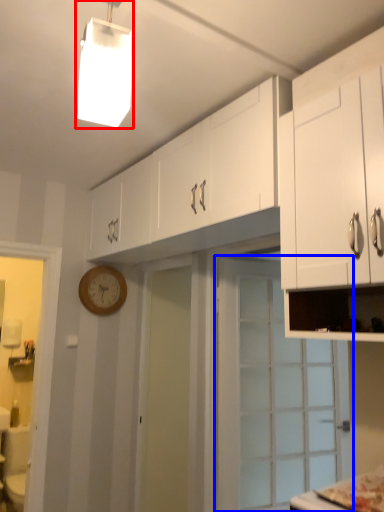
Question: Which point is further to the camera, light fixture (highlighted by a red box) or door (highlighted by a blue box)?

Choices:
 (A) light fixture
 (B) door

Answer: (B)